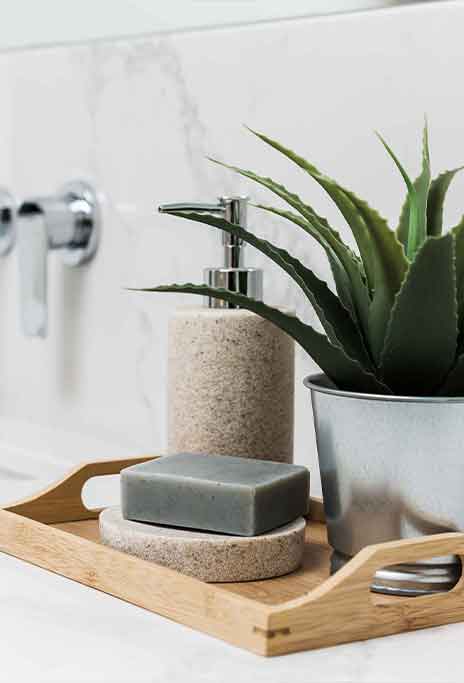
Locate an element on the screen. This screenshot has height=683, width=464. marble backsplash is located at coordinates (139, 257).